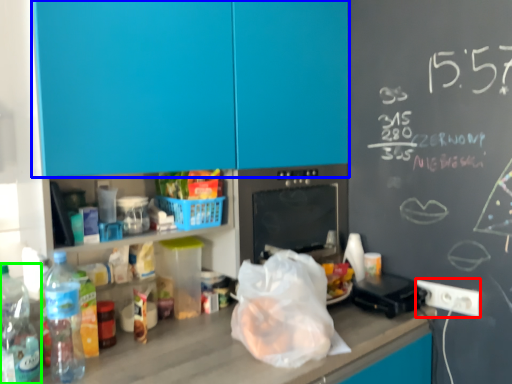
Question: Estimate the real-world distances between objects in this image. Which object is closer to electric outlet (highlighted by a red box), cabinetry (highlighted by a blue box) or bottle (highlighted by a green box)?

Choices:
 (A) cabinetry
 (B) bottle

Answer: (A)